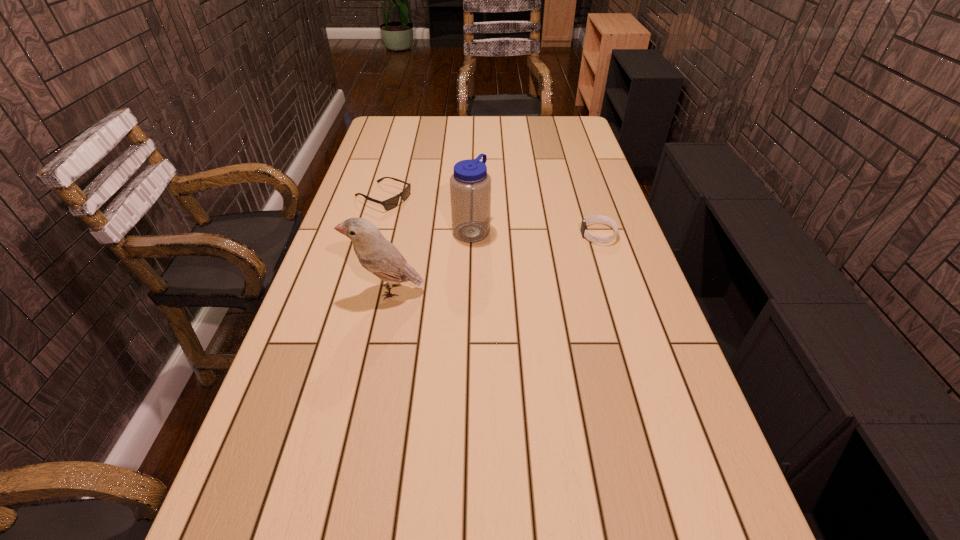
This screenshot has width=960, height=540. What are the coordinates of `free space on the desktop that is between the nearest object and the rightmost object and is positioned on the front-facing side of the farthest object` in the screenshot? It's located at (x=521, y=255).

You are a GUI agent. You are given a task and a screenshot of the screen. Output one action in this format:
    pyautogui.click(x=<x>, y=<y>)
    Task: Click on the free space on the desktop that is between the nearest object and the rightmost object and is positioned with a carrying loop on the side of the third object from left to right
    
    Given the screenshot: What is the action you would take?
    pyautogui.click(x=528, y=253)